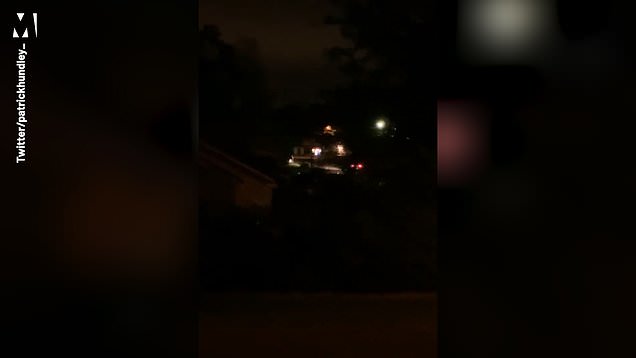
The image size is (636, 358). What are the coordinates of `corner` in the screenshot? It's located at (614, 344).